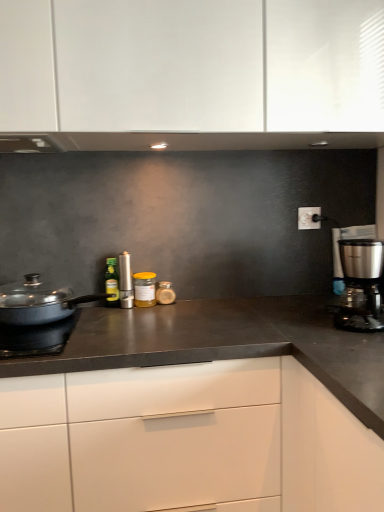
The width and height of the screenshot is (384, 512). Identify the location of vacant space that's between matte black pan at left and yellow glass jar at center, marked as the third kitchen appliance in a right-to-left arrangement. (134, 313).